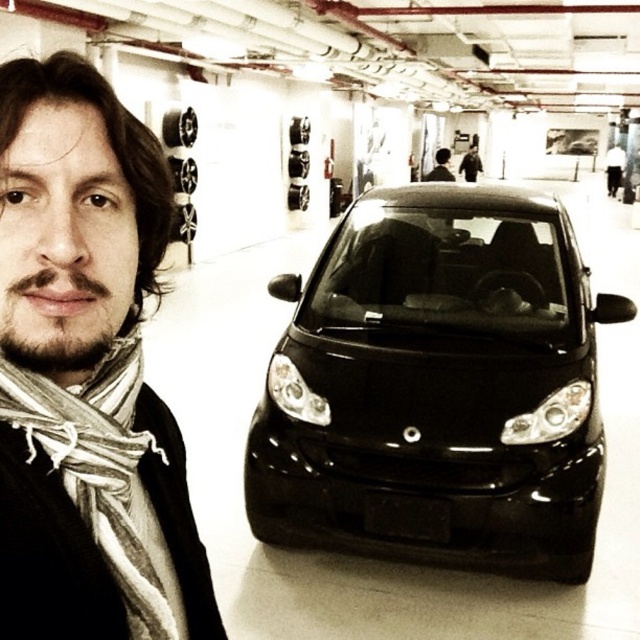
You are a photographer in a car showroom. You notice the white striped scarf at left and the matte black car at center. Which object is closer to the camera?

The white striped scarf at left is closer to the camera because it is positioned under the matte black car at center, indicating it is in front spatially.

You are standing in a car showroom and want to locate the glossy black car at center. According to the coordinates provided, where would you find it?

The glossy black car at center is located at coordinates point (436, 388).